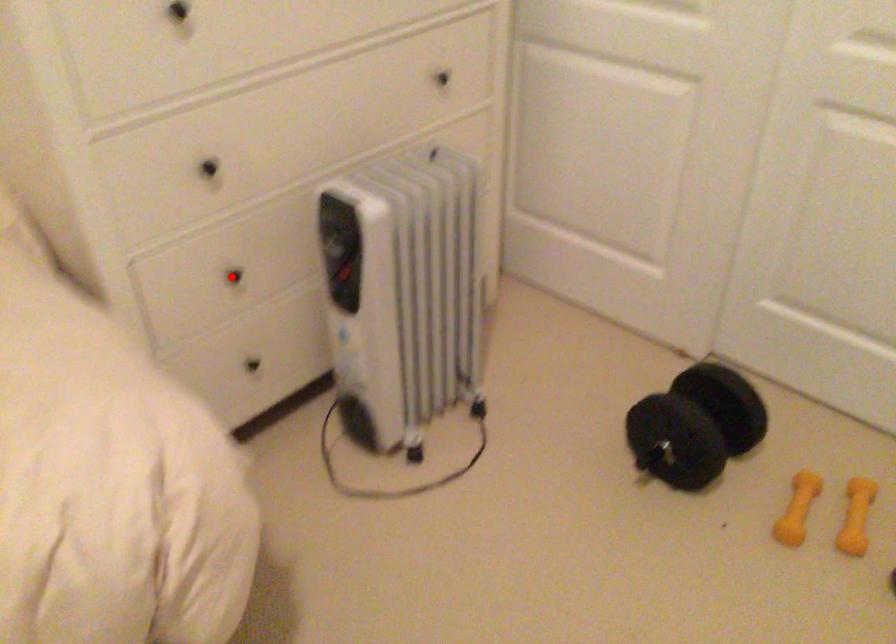
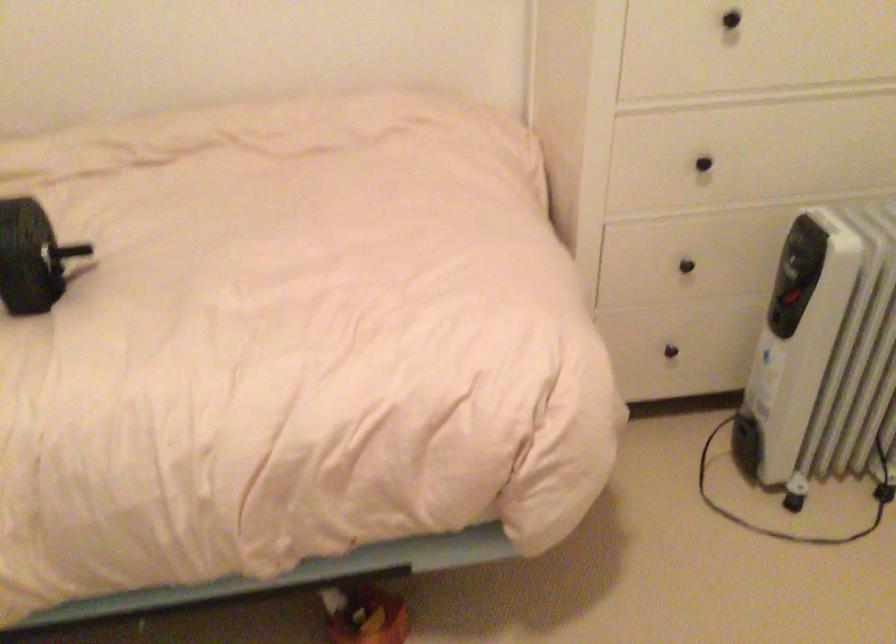
In the second image, find the point that corresponds to the highlighted location in the first image.

(685, 266)